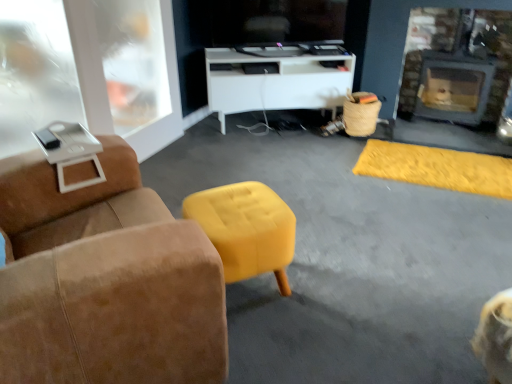
At what (x,y) coordinates should I click in order to perform the action: click on vacant space to the right of yellow fabric stool at center. Please return your answer as a coordinate pair (x, y). Looking at the image, I should click on (326, 292).